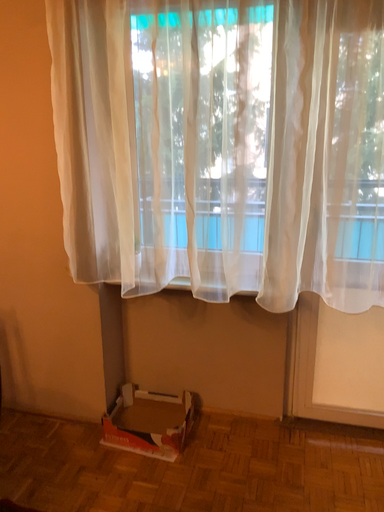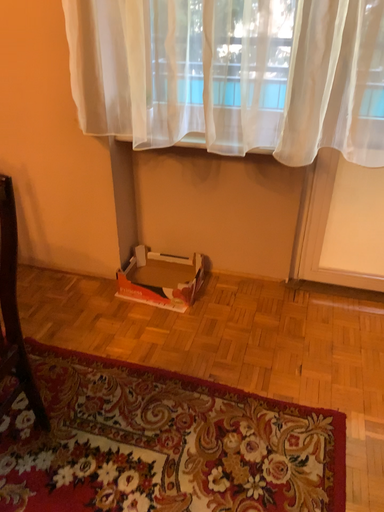
Question: How did the camera likely rotate when shooting the video?

Choices:
 (A) rotated downward
 (B) rotated upward

Answer: (A)